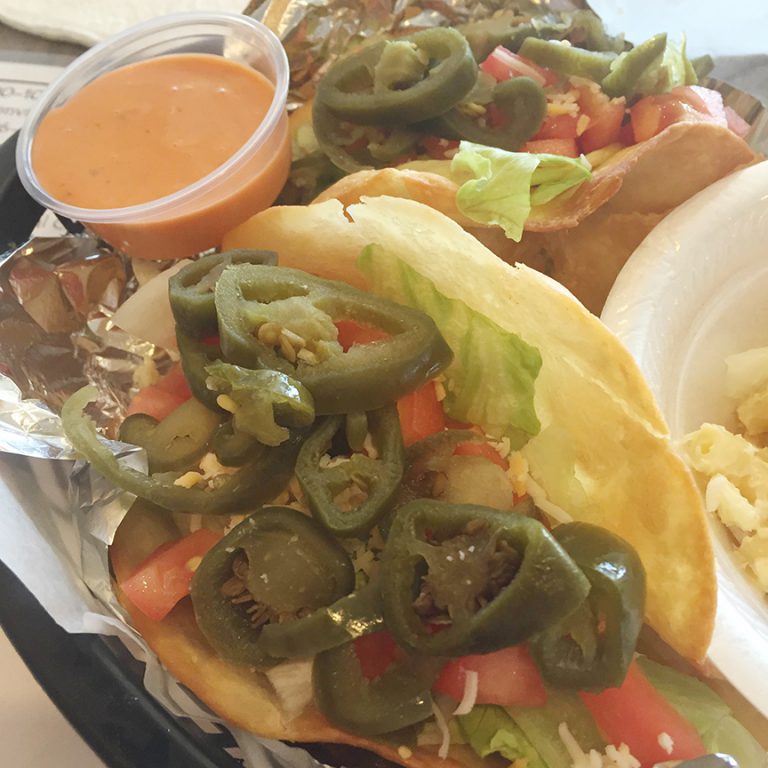
Find the location of a particular element. The image size is (768, 768). table is located at coordinates [44, 710].